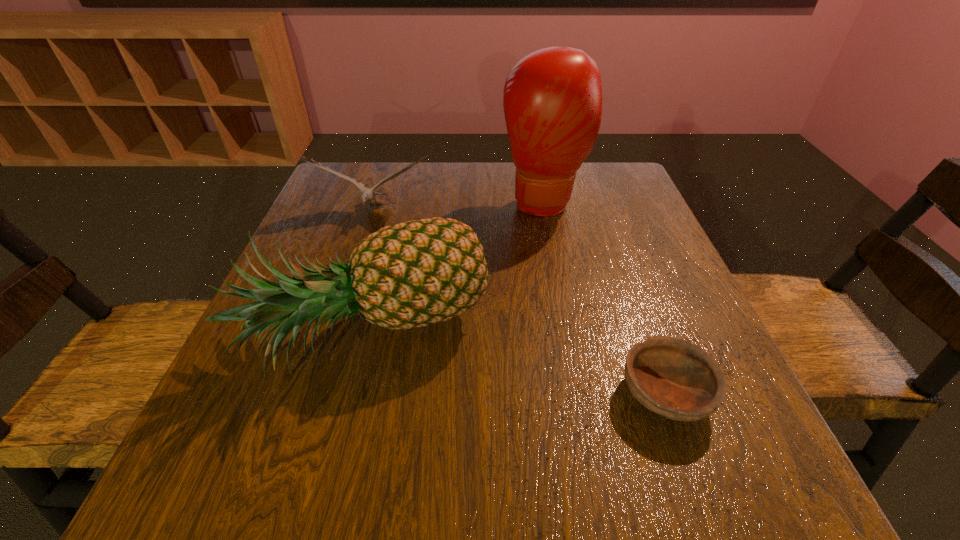
You are a GUI agent. You are given a task and a screenshot of the screen. Output one action in this format:
    pyautogui.click(x=<x>, y=<y>)
    Task: Click on the vacant area that lies between the third shortest object and the shortest object
    The width and height of the screenshot is (960, 540).
    Given the screenshot: What is the action you would take?
    pyautogui.click(x=517, y=365)

Find the location of a particular element. The height and width of the screenshot is (540, 960). empty space that is in between the third tallest object and the boxing glove is located at coordinates (459, 207).

Locate an element on the screen. The width and height of the screenshot is (960, 540). the third closest object to the second tallest object is located at coordinates (674, 378).

Locate which object is the third closest to the gull. Please provide its 2D coordinates. Your answer should be formatted as a tuple, i.e. [(x, y)], where the tuple contains the x and y coordinates of a point satisfying the conditions above.

[(674, 378)]

Find the location of a particular element. Image resolution: width=960 pixels, height=540 pixels. free space that satisfies the following two spatial constraints: 1. at the tip of the beak of the second tallest object; 2. on the left side of the third tallest object is located at coordinates (333, 337).

At what (x,y) coordinates should I click in order to perform the action: click on free space in the image that satisfies the following two spatial constraints: 1. at the tip of the beak of the second shortest object; 2. on the left side of the pineapple. Please return your answer as a coordinate pair (x, y). Looking at the image, I should click on (333, 337).

I want to click on vacant area that satisfies the following two spatial constraints: 1. at the tip of the beak of the shortest object; 2. on the left side of the gull, so click(315, 393).

At what (x,y) coordinates should I click in order to perform the action: click on vacant space that satisfies the following two spatial constraints: 1. on the striking surface of the tallest object; 2. on the left side of the bowl. Please return your answer as a coordinate pair (x, y). This screenshot has width=960, height=540. Looking at the image, I should click on [x=583, y=393].

Find the location of a particular element. free space that satisfies the following two spatial constraints: 1. on the striking surface of the bowl; 2. on the right side of the boxing glove is located at coordinates (583, 393).

Identify the location of blank area in the image that satisfies the following two spatial constraints: 1. on the striking surface of the tallest object; 2. on the right side of the bowl. (583, 393).